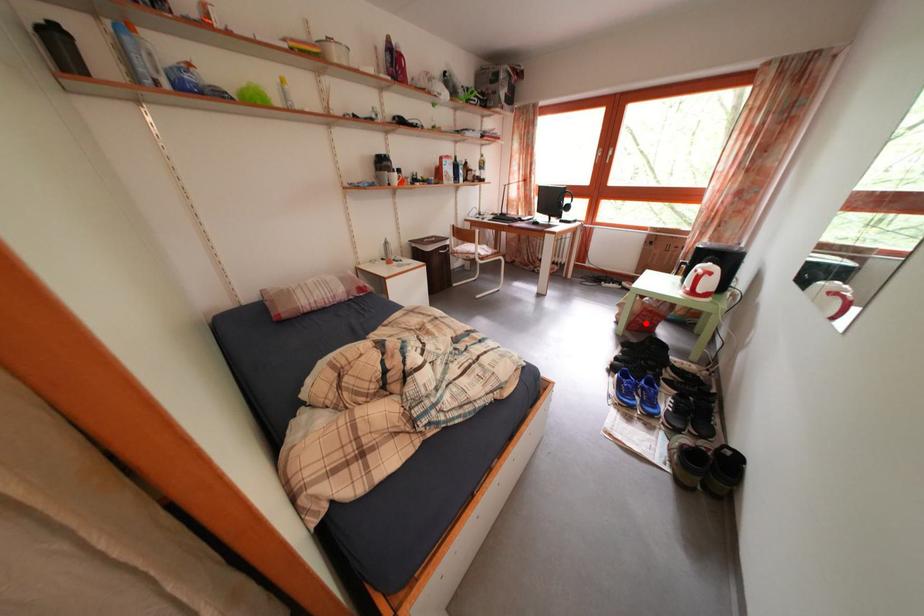
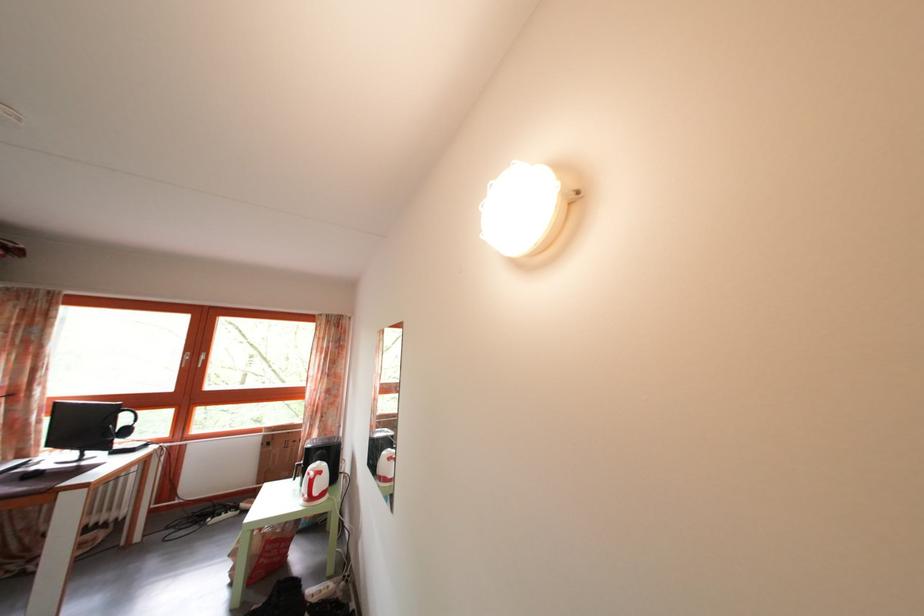
In the second image, find the point that corresponds to the highlighted location in the first image.

(268, 562)